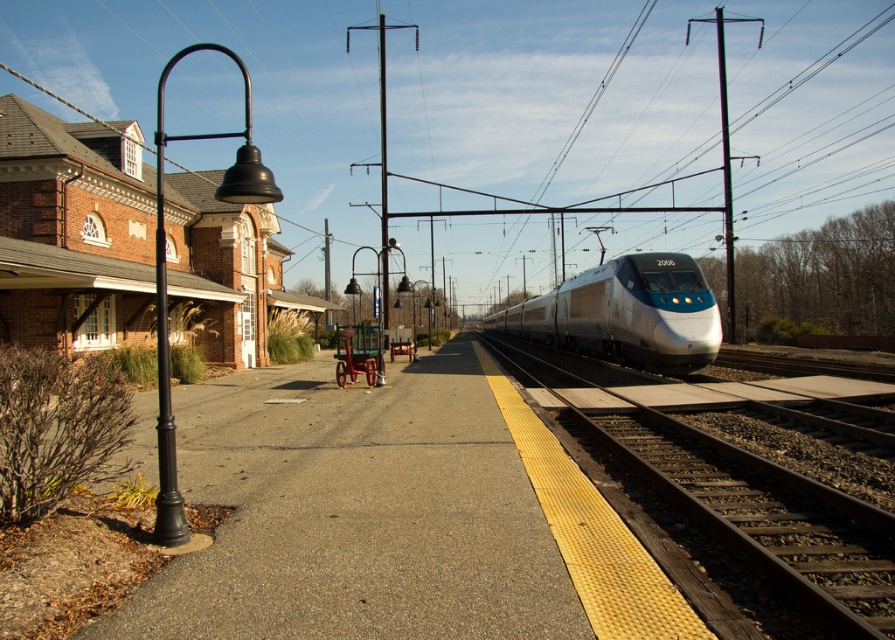
Can you confirm if metallic gray train track at center is shorter than metallic pole at right?

Yes, metallic gray train track at center is shorter than metallic pole at right.

Identify the location of metallic gray train track at center. (736, 513).

Identify the location of metallic gray train track at center. (736, 513).

This screenshot has width=895, height=640. Describe the element at coordinates (736, 513) in the screenshot. I see `metallic gray train track at center` at that location.

Identify the location of metallic gray train track at center. (736, 513).

This screenshot has width=895, height=640. What do you see at coordinates (725, 154) in the screenshot? I see `metallic pole at right` at bounding box center [725, 154].

Can you confirm if metallic pole at right is smaller than metallic pole at center?

Actually, metallic pole at right might be larger than metallic pole at center.

What do you see at coordinates (725, 154) in the screenshot? I see `metallic pole at right` at bounding box center [725, 154].

The height and width of the screenshot is (640, 895). What are the coordinates of `metallic pole at right` in the screenshot? It's located at (725, 154).